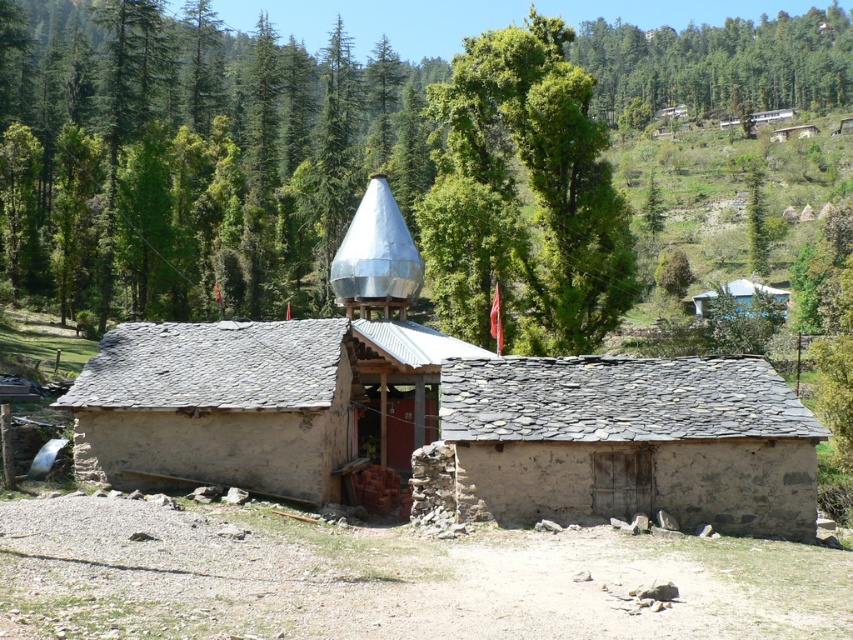
You are an architect designing a new eco lodge and are analyzing the image. You need to determine the spatial relationship between the green leafy pine forest at upper center and the green leafy tree at upper right. Which one has a greater width in the image?

The green leafy pine forest at upper center has a greater width than the green leafy tree at upper right according to the description.

You are a hiker who wants to take a photo of the gray stone hut at center and the white painted wood hut at upper right. Which one should you stand closer to if you want both to appear equally sized in your photo?

You should stand closer to the gray stone hut at center because it is shorter than the white painted wood hut at upper right. By positioning yourself nearer to the smaller hut, you can balance their apparent sizes in the photo.

You are an architect designing a new eco lodge and are inspired by the rustic stone hut at center and the green leafy tree at upper right. Which of these two elements would you need to scale down in your design to ensure they fit within the designated plot size?

The rustic stone hut at center is smaller than the green leafy tree at upper right, so you would need to scale down the green leafy tree at upper right to ensure it fits within the designated plot size.